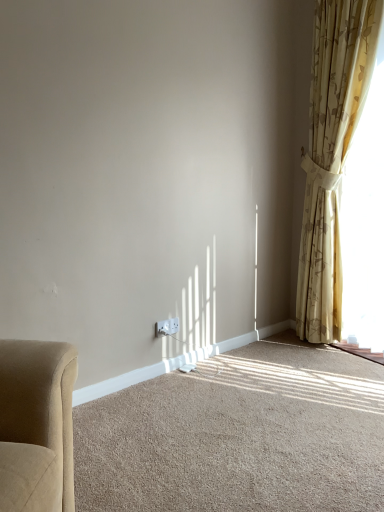
What do you see at coordinates (167, 327) in the screenshot?
I see `white plastic electric outlet at lower center` at bounding box center [167, 327].

Image resolution: width=384 pixels, height=512 pixels. Describe the element at coordinates (239, 435) in the screenshot. I see `beige carpet at lower center` at that location.

This screenshot has height=512, width=384. Find the location of `white plastic electric outlet at lower center`. white plastic electric outlet at lower center is located at coordinates (167, 327).

Looking at this image, from the image's perspective, is beige carpet at lower center above or below white plastic electric outlet at lower center?

Clearly, from the image's perspective, beige carpet at lower center is below white plastic electric outlet at lower center.

Does beige carpet at lower center lie behind white plastic electric outlet at lower center?

That is False.

Can you confirm if beige carpet at lower center is positioned to the left of white plastic electric outlet at lower center?

In fact, beige carpet at lower center is to the right of white plastic electric outlet at lower center.

Between yellow floral curtain at right and white plastic electric outlet at lower center, which one has smaller width?

With smaller width is white plastic electric outlet at lower center.

Considering the relative sizes of yellow floral curtain at right and white plastic electric outlet at lower center in the image provided, is yellow floral curtain at right taller than white plastic electric outlet at lower center?

Indeed, yellow floral curtain at right has a greater height compared to white plastic electric outlet at lower center.

Identify the location of curtain that is above the white plastic electric outlet at lower center (from a real-world perspective). (331, 155).

Based on their positions, is yellow floral curtain at right located to the left or right of white plastic electric outlet at lower center?

From the image, it's evident that yellow floral curtain at right is to the right of white plastic electric outlet at lower center.

From the image's perspective, which is below, beige carpet at lower center or yellow floral curtain at right?

beige carpet at lower center, from the image's perspective.

From a real-world perspective, is beige carpet at lower center positioned above or below yellow floral curtain at right?

From a real-world perspective, beige carpet at lower center is physically below yellow floral curtain at right.

Is the depth of beige carpet at lower center greater than that of yellow floral curtain at right?

No, it is not.

Is beige carpet at lower center positioned with its back to yellow floral curtain at right?

beige carpet at lower center does not have its back to yellow floral curtain at right.

Locate an element on the screen. The width and height of the screenshot is (384, 512). curtain to the right of white plastic electric outlet at lower center is located at coordinates (331, 155).

Is white plastic electric outlet at lower center spatially inside yellow floral curtain at right, or outside of it?

white plastic electric outlet at lower center is located beyond the bounds of yellow floral curtain at right.

Consider the image. How distant is white plastic electric outlet at lower center from yellow floral curtain at right?

They are 4.08 feet apart.

Is white plastic electric outlet at lower center oriented away from yellow floral curtain at right?

No, yellow floral curtain at right is not at the back of white plastic electric outlet at lower center.

Is white plastic electric outlet at lower center wider than beige carpet at lower center?

No.

Does point (155, 323) come in front of point (225, 454)?

No, it is behind (225, 454).

From a real-world perspective, is white plastic electric outlet at lower center positioned above or below beige carpet at lower center?

In terms of real-world spatial position, white plastic electric outlet at lower center is above beige carpet at lower center.

From a real-world perspective, is yellow floral curtain at right physically below beige carpet at lower center?

No, from a real-world perspective, yellow floral curtain at right is not below beige carpet at lower center.

Based on the photo, from the image's perspective, is yellow floral curtain at right located above or below beige carpet at lower center?

From the image's perspective, yellow floral curtain at right appears above beige carpet at lower center.

Looking at this image, is beige carpet at lower center surrounded by yellow floral curtain at right?

No, yellow floral curtain at right does not contain beige carpet at lower center.

Does point (327, 226) come farther from viewer compared to point (184, 483)?

Yes, point (327, 226) is behind point (184, 483).

Locate an element on the screen. The image size is (384, 512). electric outlet above the beige carpet at lower center (from the image's perspective) is located at coordinates (167, 327).

I want to click on curtain positioned vertically above the white plastic electric outlet at lower center (from a real-world perspective), so tap(331, 155).

Based on their spatial positions, is yellow floral curtain at right or white plastic electric outlet at lower center closer to beige carpet at lower center?

The object closer to beige carpet at lower center is white plastic electric outlet at lower center.

Which object lies nearer to the anchor point white plastic electric outlet at lower center, beige carpet at lower center or yellow floral curtain at right?

beige carpet at lower center lies closer to white plastic electric outlet at lower center than the other object.

Considering their positions, is white plastic electric outlet at lower center positioned further to yellow floral curtain at right than beige carpet at lower center?

white plastic electric outlet at lower center lies further to yellow floral curtain at right than the other object.

Estimate the real-world distances between objects in this image. Which object is further from yellow floral curtain at right, beige carpet at lower center or white plastic electric outlet at lower center?

white plastic electric outlet at lower center.

From the image, which object appears to be farther from white plastic electric outlet at lower center, yellow floral curtain at right or beige carpet at lower center?

Among the two, yellow floral curtain at right is located further to white plastic electric outlet at lower center.

Consider the image. From the image, which object appears to be farther from beige carpet at lower center, white plastic electric outlet at lower center or yellow floral curtain at right?

yellow floral curtain at right is positioned further to the anchor beige carpet at lower center.

At what (x,y) coordinates should I click in order to perform the action: click on curtain between beige carpet at lower center and white plastic electric outlet at lower center from front to back. Please return your answer as a coordinate pair (x, y). Image resolution: width=384 pixels, height=512 pixels. Looking at the image, I should click on (331, 155).